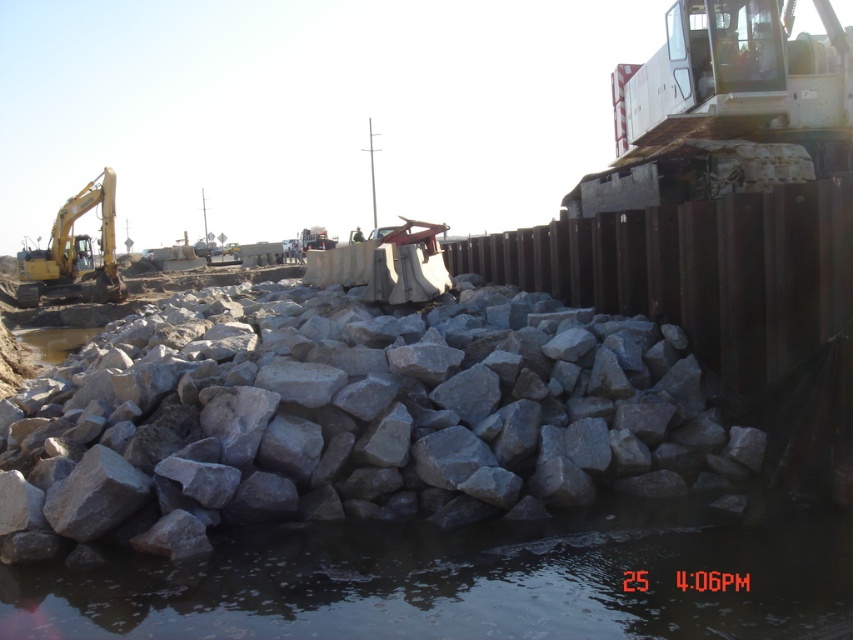
You are standing at the point marked as point (468,579) in the image. Based on the scene description, what is the immediate surface you are standing on?

The point (468,579) is on clear water at lower center, so the immediate surface you are standing on is clear water.

You are standing at the edge of the construction site near the clear water at lower center. You need to place a safety barrier that must be at least 4 meters away from the water to prevent contamination. Can you safely place the barrier where you are standing?

The clear water at lower center is 3.94 meters away from you. Since the required distance is 4 meters, you are too close to place the barrier here safely.